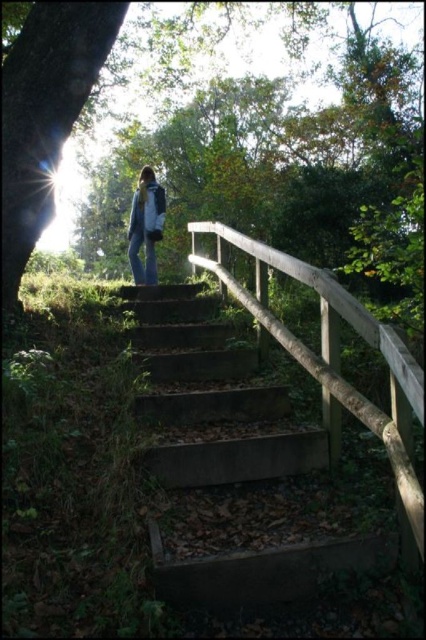
You are a hiker who has just reached the top of the concrete stairs at center and wants to take a photo of the smooth bark tree at left. Which object should you stand closer to in order to get a better view of the entire tree?

You should stand closer to the concrete stairs at center because it is shorter than the smooth bark tree at left, allowing you to capture the entire tree in your photo.

You are standing at the bottom of the concrete stairs at center and want to walk up to the person at the top. Which direction should you look to avoid the smooth bark tree at left blocking your view?

You should look to the right side of the concrete stairs at center to avoid the smooth bark tree at left blocking your view since the stairs are positioned under the tree, which is on the left side.